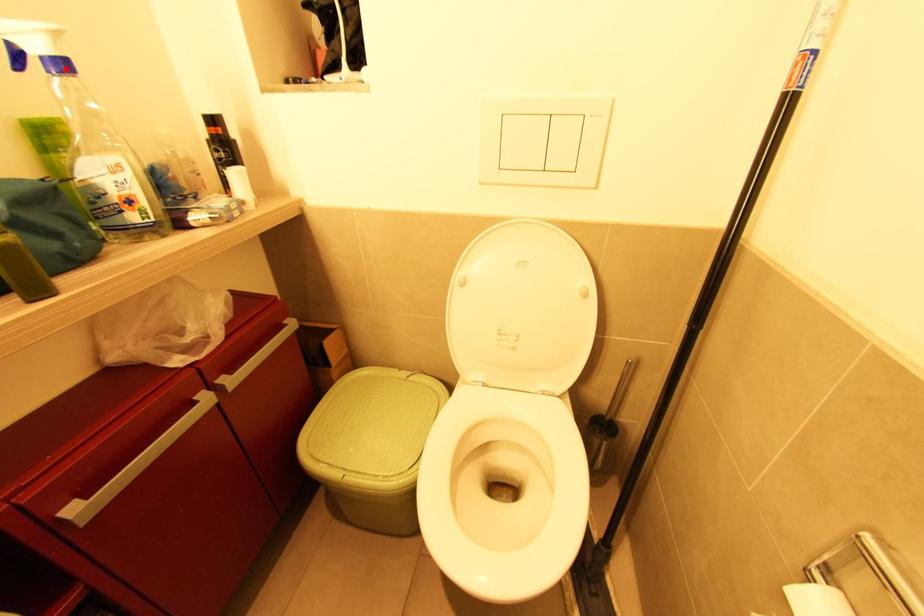
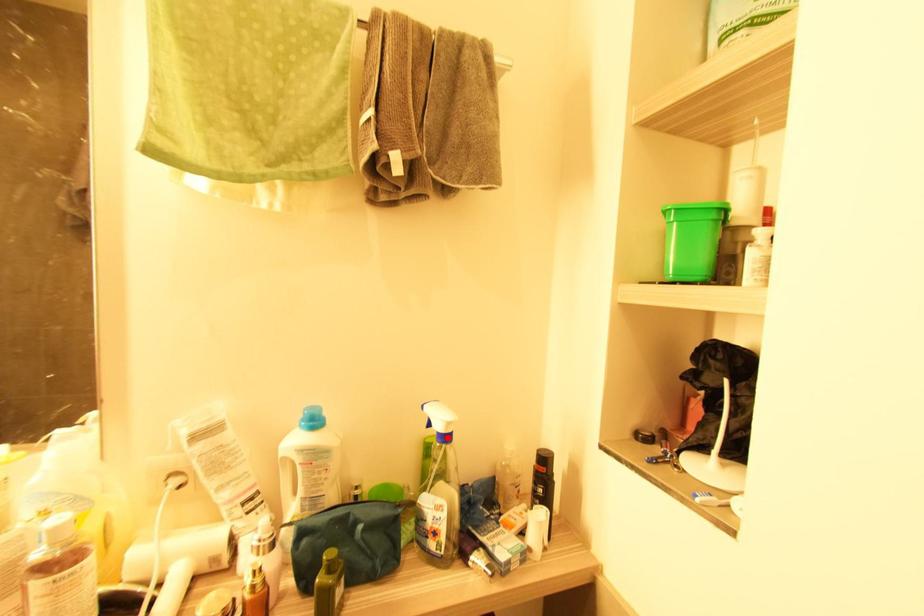
I am providing you with two images of the same scene from different viewpoints. A red point is marked on the first image and another point is marked on the second image. Are the points marked in image1 and image2 representing the same 3D position?

Yes